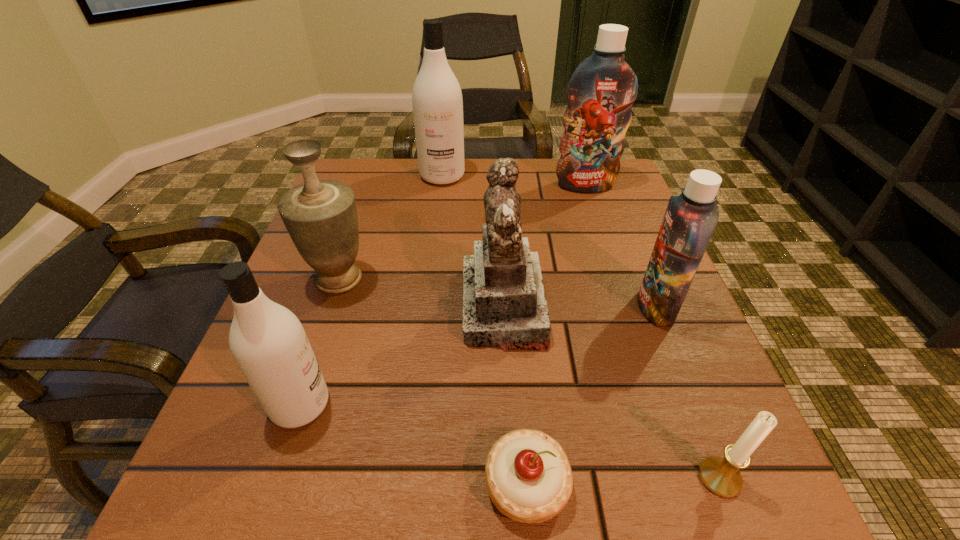
I want to click on free point located on the front label of the smaller blue shampoo, so pos(485,307).

The width and height of the screenshot is (960, 540). Find the location of `vacant space located 0.090m on the front-facing side of the third nearest object`. vacant space located 0.090m on the front-facing side of the third nearest object is located at coordinates (390, 404).

What are the coordinates of `free space located on the left of the candle holder` in the screenshot? It's located at (638, 478).

In order to click on free spot located 0.350m on the left of the shortest object in this screenshot , I will do `click(217, 484)`.

Identify the location of candle holder at the near edge. (721, 476).

Identify the location of pastry positioned at the near edge. (529, 479).

Where is `urn that is positioned at the left edge`? This screenshot has width=960, height=540. urn that is positioned at the left edge is located at coordinates (320, 216).

You are a GUI agent. You are given a task and a screenshot of the screen. Output one action in this format:
    pyautogui.click(x=<x>, y=<y>)
    Task: Click on the shampoo that is positioned at the left edge
    This screenshot has height=540, width=960.
    Given the screenshot: What is the action you would take?
    pos(268,342)

The width and height of the screenshot is (960, 540). I want to click on candle holder situated at the right edge, so click(x=721, y=476).

The width and height of the screenshot is (960, 540). Find the location of `object that is positioned at the far right corner`. object that is positioned at the far right corner is located at coordinates (601, 91).